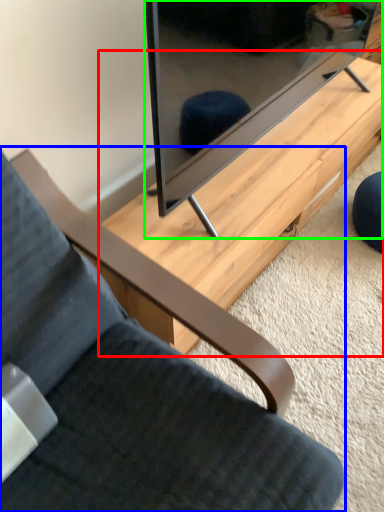
Question: Considering the real-world distances, which object is farthest from table (highlighted by a red box)? chair (highlighted by a blue box) or television (highlighted by a green box)?

Choices:
 (A) chair
 (B) television

Answer: (A)